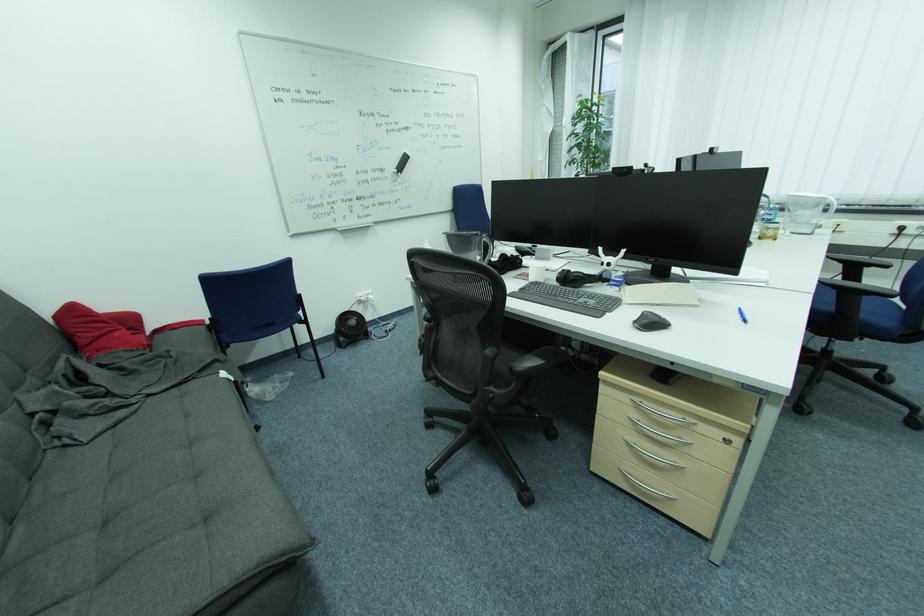
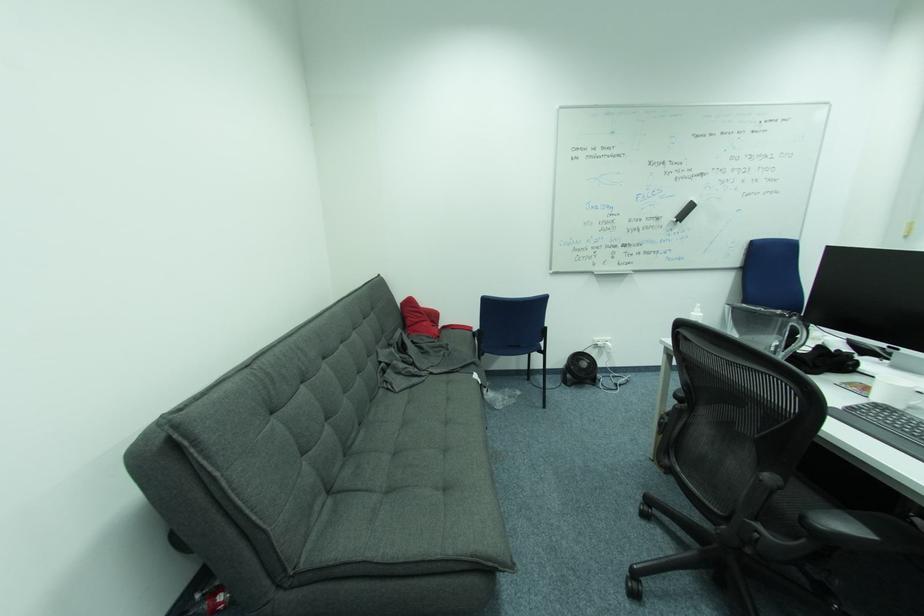
Question: How did the camera likely rotate?

Choices:
 (A) Left
 (B) Right
 (C) Up
 (D) Down

Answer: (A)